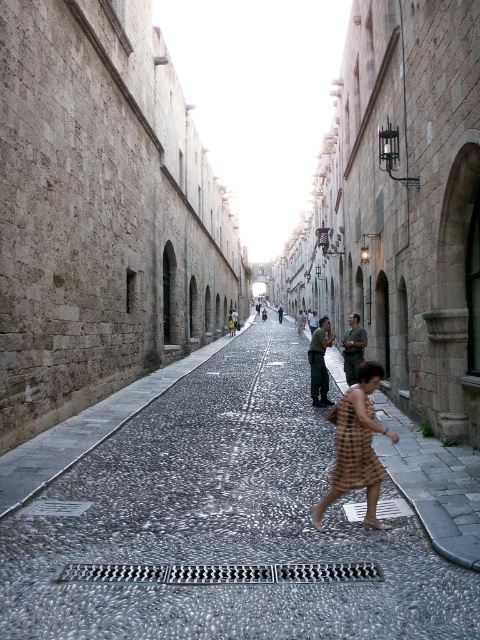
You are standing at the entrance of the street and want to walk to the middle of the gray cobblestone pavement at center. What are the coordinates of the point you should aim for?

The gray cobblestone pavement at center is located at coordinates point (222, 524). So you should aim for point (222, 524).